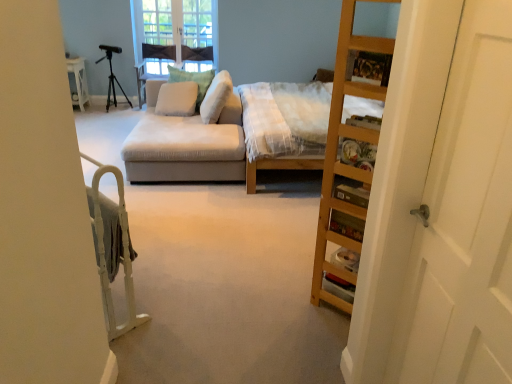
Image resolution: width=512 pixels, height=384 pixels. I want to click on vacant area that is in front of suede-like beige couch at center, so click(x=206, y=218).